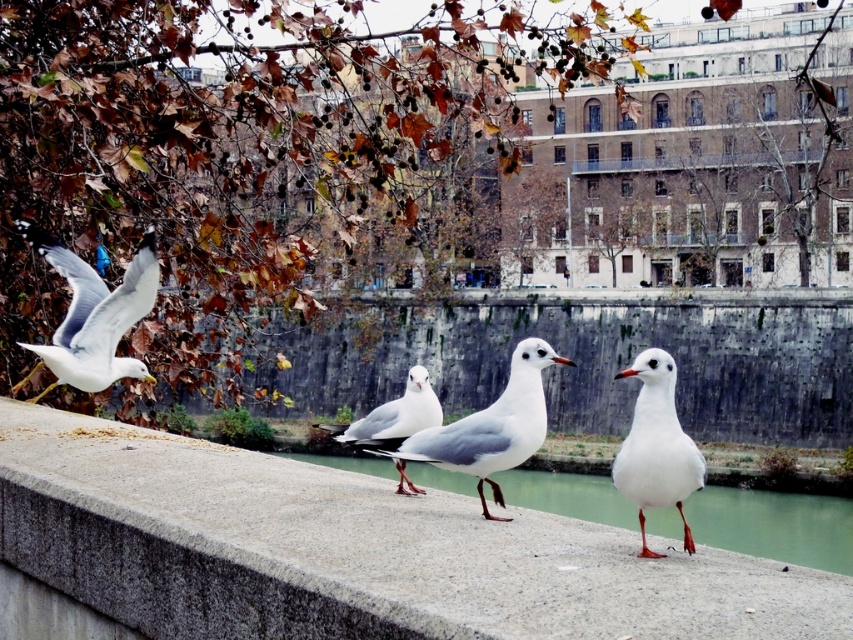
Which is below, green water at lower center or white matte bird at center?

Positioned lower is green water at lower center.

Does point (849, 540) come farther from viewer compared to point (683, 481)?

Yes, point (849, 540) is behind point (683, 481).

Based on the photo, who is more distant from viewer, (x=749, y=496) or (x=621, y=371)?

Positioned behind is point (x=749, y=496).

You are a GUI agent. You are given a task and a screenshot of the screen. Output one action in this format:
    pyautogui.click(x=<x>, y=<y>)
    Task: Click on the green water at lower center
    
    Given the screenshot: What is the action you would take?
    pyautogui.click(x=775, y=524)

Is green water at lower center in front of white matte/glossy seagull at center?

That is True.

Which of these two, green water at lower center or white matte/glossy seagull at center, stands taller?

green water at lower center

Locate an element on the screen. This screenshot has height=640, width=853. green water at lower center is located at coordinates (775, 524).

Can you confirm if green water at lower center is bigger than white glossy seagull at left?

Correct, green water at lower center is larger in size than white glossy seagull at left.

Which is behind, point (785, 560) or point (93, 305)?

The point (785, 560) is behind.

You are a GUI agent. You are given a task and a screenshot of the screen. Output one action in this format:
    pyautogui.click(x=<x>, y=<y>)
    Task: Click on the green water at lower center
    The width and height of the screenshot is (853, 640).
    Given the screenshot: What is the action you would take?
    pyautogui.click(x=775, y=524)